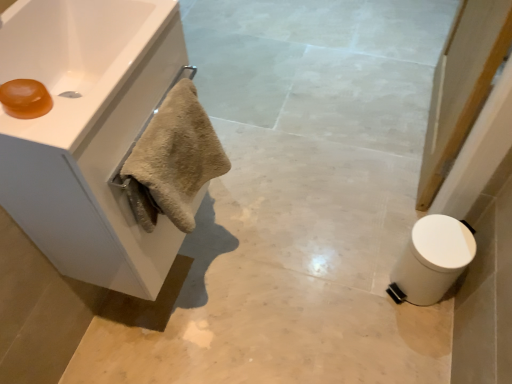
Where is `vacant area that lies to the right of white matte cabinet at upper left`? The height and width of the screenshot is (384, 512). vacant area that lies to the right of white matte cabinet at upper left is located at coordinates (248, 267).